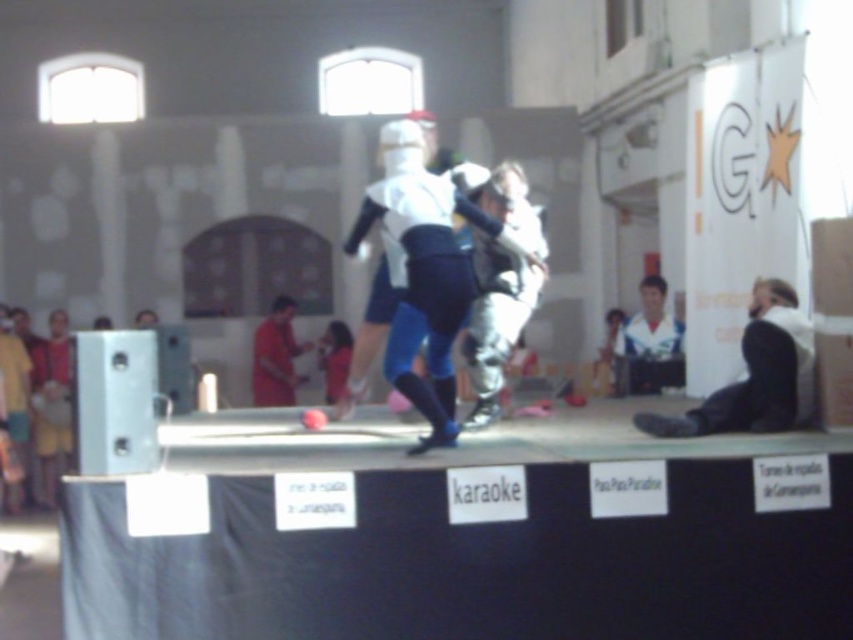
Does white matte helmet at center have a lesser height compared to orange matte shirt at center?

No.

Does white matte helmet at center come behind orange matte shirt at center?

No, it is not.

Who is more forward, [395,244] or [259,364]?

Point [395,244] is more forward.

Locate an element on the screen. The height and width of the screenshot is (640, 853). white matte helmet at center is located at coordinates (424, 269).